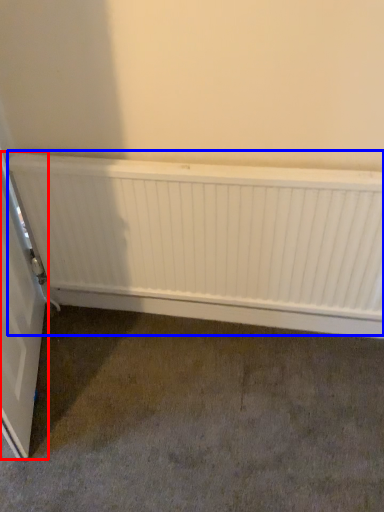
Question: Which object appears closest to the camera in this image, door (highlighted by a red box) or radiator (highlighted by a blue box)?

Choices:
 (A) door
 (B) radiator

Answer: (A)